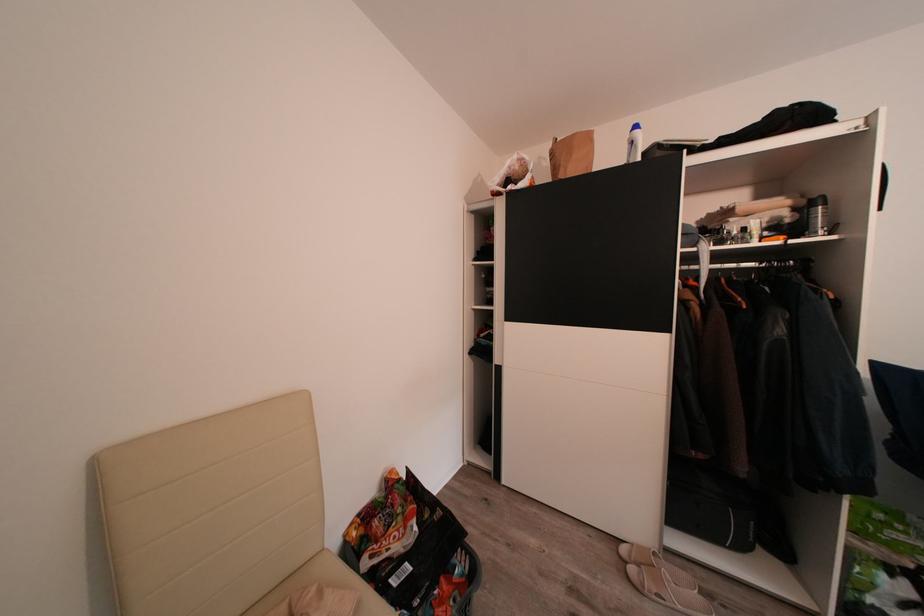
The location [634,143] corresponds to which object?

It refers to a white plastic bottle.